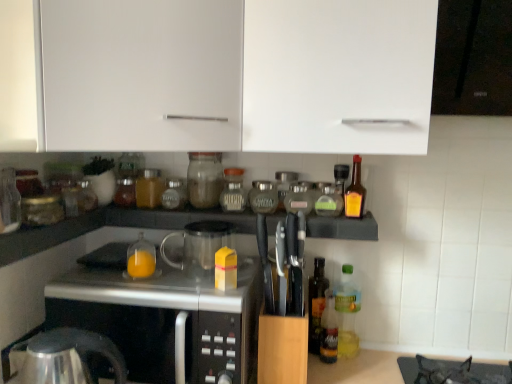
At what (x,y) coordinates should I click in order to perform the action: click on free space to the back side of translucent plastic carton at center, the second orange juice viewed from the back. Please return your answer as a coordinate pair (x, y). Looking at the image, I should click on (208, 279).